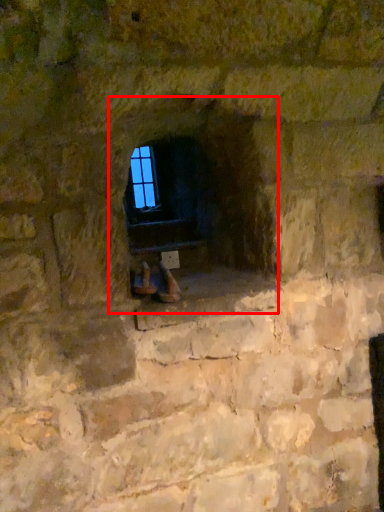
Question: Observing the image, what is the correct spatial positioning of fireplace (annotated by the red box) in reference to window?

Choices:
 (A) left
 (B) right

Answer: (B)